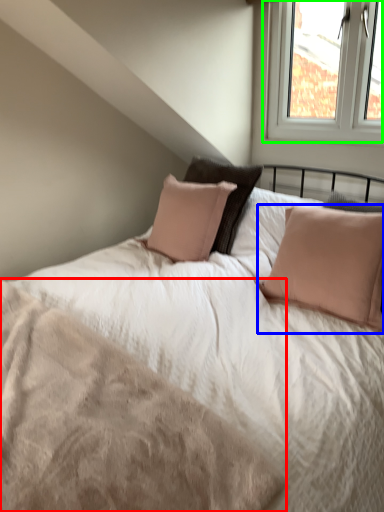
Question: Which object is positioned closest to mattress (highlighted by a red box)? Select from pillow (highlighted by a blue box) and window (highlighted by a green box).

Choices:
 (A) pillow
 (B) window

Answer: (A)